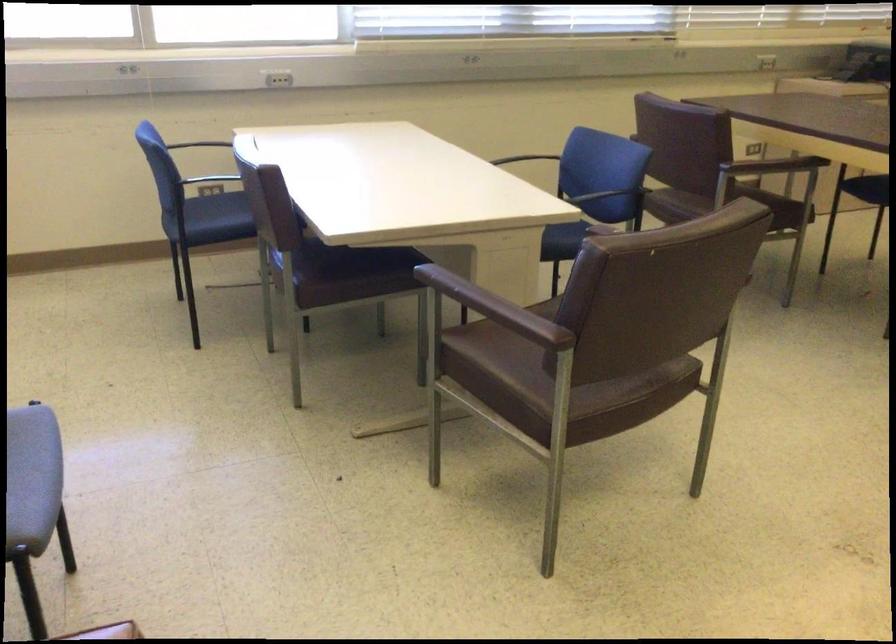
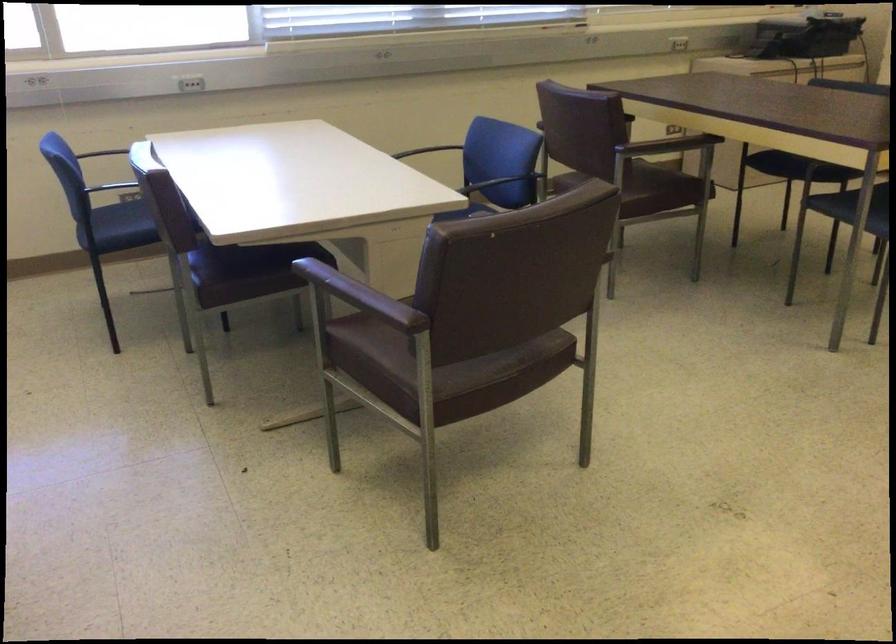
In a continuous first-person perspective shot, in which direction is the camera moving?

The movement direction of the cameraman is right, backward.